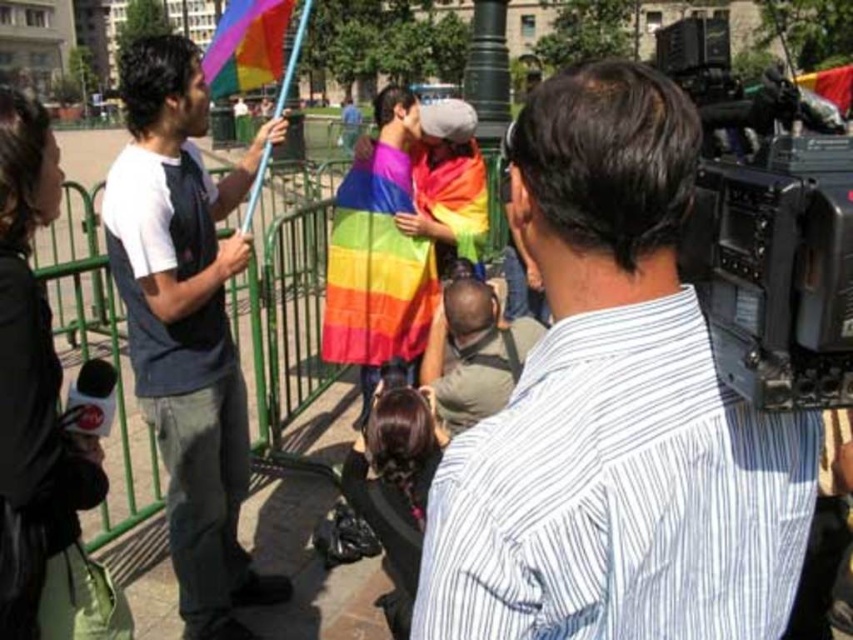
You are a photographer at the event and need to capture a photo of the rainbow flags in the midground. The white striped shirt at upper right and the black plastic video camera at right are blocking your view. Which object is closer to the rainbow flags so you can ask someone to move it first?

The white striped shirt at upper right is below the black plastic video camera at right, meaning it is closer to the rainbow flags. You should ask someone to move the white striped shirt at upper right first to unblock the view.

In the scene, you see a white striped shirt at upper right and a black plastic video camera at right. Which object is positioned to the left of the other?

The white striped shirt at upper right is to the left of the black plastic video camera at right.